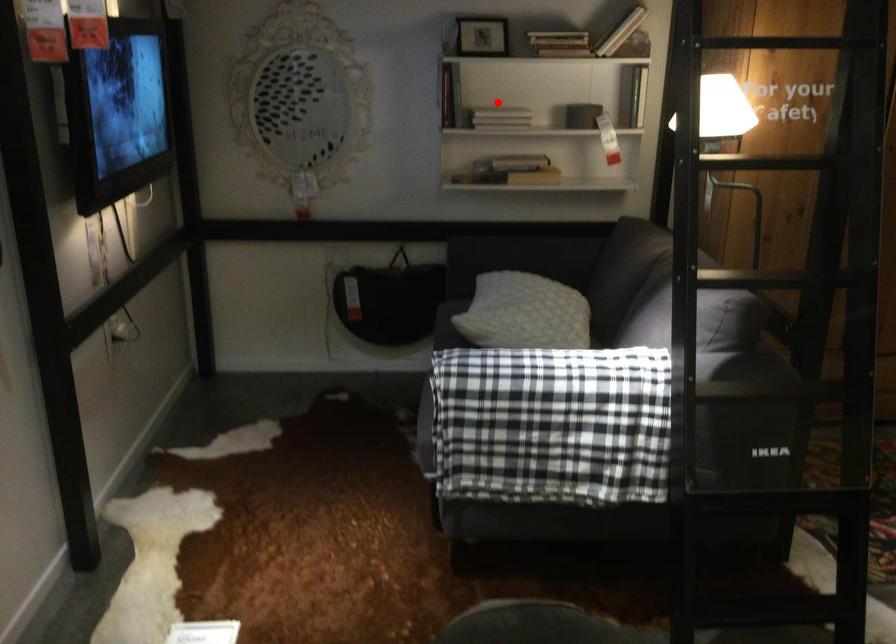
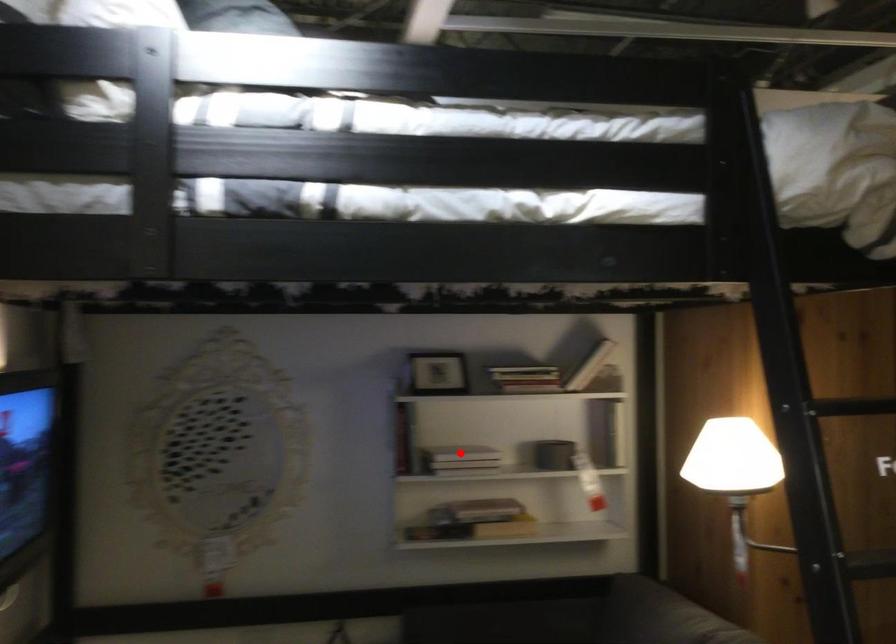
Based on the photo, I am providing you with two images of the same scene from different viewpoints. A red point is marked on the first image and another point is marked on the second image. Are the points marked in image1 and image2 representing the same 3D position?

Yes